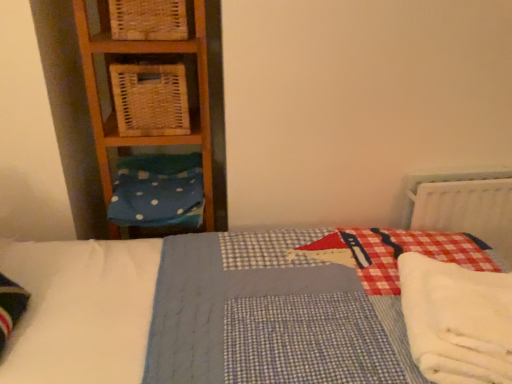
I want to click on empty space that is ontop of white fluffy blanket at lower right (from a real-world perspective), so click(466, 317).